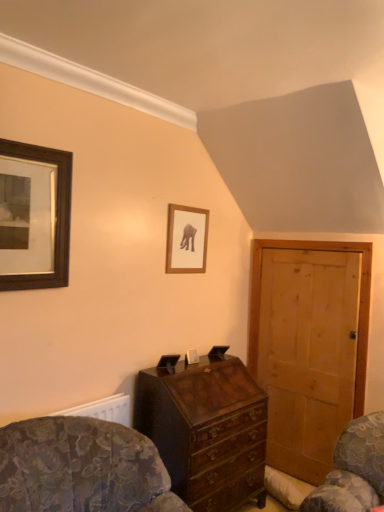
Question: Is the depth of mahogany wooden chest of drawers at center greater than that of wooden framed picture at upper left, positioned as the first picture frame in left-to-right order?

Choices:
 (A) yes
 (B) no

Answer: (A)

Question: Can you confirm if mahogany wooden chest of drawers at center is smaller than wooden framed picture at upper left, which is the second picture frame in back-to-front order?

Choices:
 (A) yes
 (B) no

Answer: (B)

Question: Is mahogany wooden chest of drawers at center thinner than wooden framed picture at upper left, which is the second picture frame in back-to-front order?

Choices:
 (A) yes
 (B) no

Answer: (B)

Question: Is mahogany wooden chest of drawers at center facing towards wooden framed picture at upper left, the first picture frame positioned from the front?

Choices:
 (A) yes
 (B) no

Answer: (B)

Question: From a real-world perspective, is mahogany wooden chest of drawers at center on wooden framed picture at upper left, positioned as the first picture frame in left-to-right order?

Choices:
 (A) no
 (B) yes

Answer: (A)

Question: Looking at their shapes, would you say wooden framed picture at upper left, the first picture frame positioned from the front, is wider or thinner than mahogany wooden chest of drawers at center?

Choices:
 (A) wide
 (B) thin

Answer: (B)

Question: From a real-world perspective, is wooden framed picture at upper left, the first picture frame positioned from the front, positioned above or below mahogany wooden chest of drawers at center?

Choices:
 (A) below
 (B) above

Answer: (B)

Question: Is point (46, 147) positioned closer to the camera than point (160, 381)?

Choices:
 (A) farther
 (B) closer

Answer: (B)

Question: Based on their sizes in the image, would you say wooden framed picture at upper left, the first picture frame positioned from the front, is bigger or smaller than mahogany wooden chest of drawers at center?

Choices:
 (A) big
 (B) small

Answer: (B)

Question: In terms of width, does patterned fabric rocking chair at lower left look wider or thinner when compared to mahogany wooden chest of drawers at center?

Choices:
 (A) thin
 (B) wide

Answer: (B)

Question: Based on their sizes in the image, would you say patterned fabric rocking chair at lower left is bigger or smaller than mahogany wooden chest of drawers at center?

Choices:
 (A) big
 (B) small

Answer: (A)

Question: From a real-world perspective, relative to mahogany wooden chest of drawers at center, is patterned fabric rocking chair at lower left vertically above or below?

Choices:
 (A) above
 (B) below

Answer: (A)

Question: Is patterned fabric rocking chair at lower left spatially inside mahogany wooden chest of drawers at center, or outside of it?

Choices:
 (A) inside
 (B) outside

Answer: (B)

Question: From the image's perspective, relative to mahogany wooden chest of drawers at center, is wooden framed picture at center, positioned as the 1th picture frame in right-to-left order, above or below?

Choices:
 (A) below
 (B) above

Answer: (B)

Question: Based on their sizes in the image, would you say wooden framed picture at center, arranged as the 2th picture frame when viewed from the left, is bigger or smaller than mahogany wooden chest of drawers at center?

Choices:
 (A) big
 (B) small

Answer: (B)